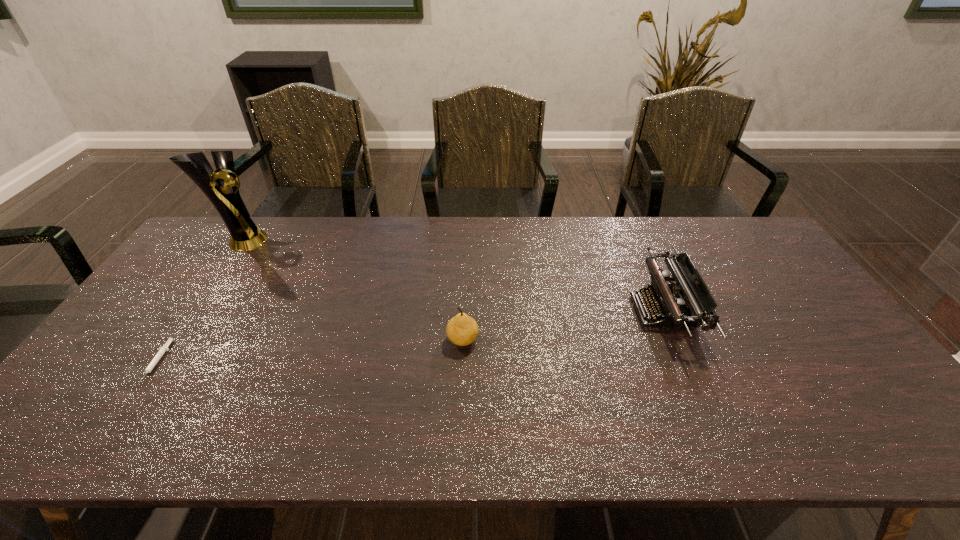
Where is `free space between the typewriter and the shortest object`? free space between the typewriter and the shortest object is located at coordinates (410, 337).

Locate an element on the screen. The image size is (960, 540). vacant area that lies between the tallest object and the typewriter is located at coordinates (452, 276).

Identify the location of vacant area that lies between the syringe and the typewriter. (410, 337).

Identify the location of blank region between the shortest object and the second object from right to left. (310, 352).

In order to click on vacant area that lies between the typewriter and the shortest object in this screenshot , I will do `click(410, 337)`.

You are a GUI agent. You are given a task and a screenshot of the screen. Output one action in this format:
    pyautogui.click(x=<x>, y=<y>)
    Task: Click on the vacant area that lies between the second object from right to left and the shortest object
    This screenshot has height=540, width=960.
    Given the screenshot: What is the action you would take?
    pyautogui.click(x=310, y=352)

Find the location of a particular element. The image size is (960, 540). vacant space in between the second object from right to left and the farthest object is located at coordinates (352, 291).

Where is `free space that is in between the pear and the rightmost object`? The width and height of the screenshot is (960, 540). free space that is in between the pear and the rightmost object is located at coordinates (563, 326).

Where is `object that is the closest to the third object from left to right`? object that is the closest to the third object from left to right is located at coordinates (667, 298).

Locate which object is the third closest to the pear. Please provide its 2D coordinates. Your answer should be formatted as a tuple, i.e. [(x, y)], where the tuple contains the x and y coordinates of a point satisfying the conditions above.

[(162, 350)]